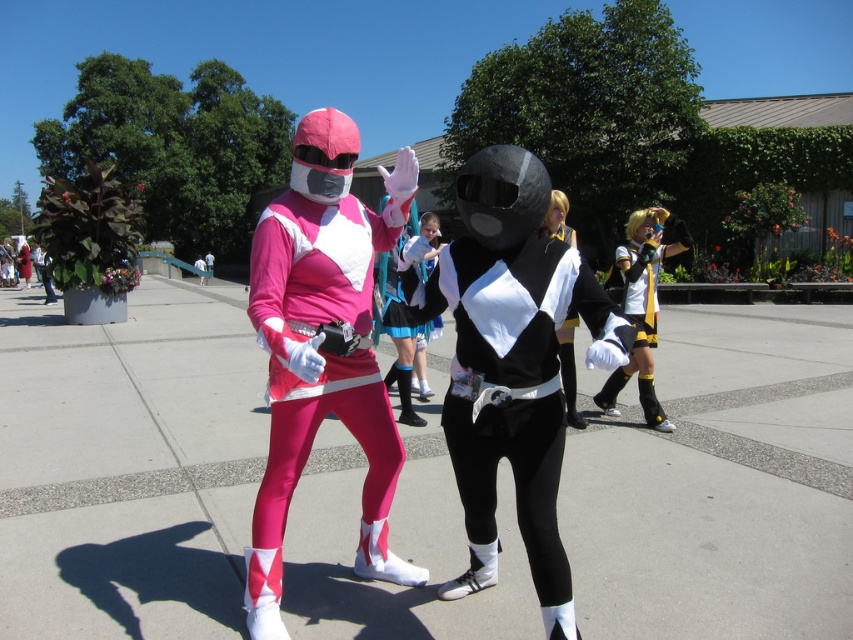
Who is shorter, matte pink costume at center or yellow and black fabric costume at right?

Standing shorter between the two is matte pink costume at center.

Who is positioned more to the left, matte pink costume at center or yellow and black fabric costume at right?

Positioned to the left is matte pink costume at center.

Which is behind, point (293, 381) or point (618, 372)?

The point (618, 372) is more distant.

Where is `matte pink costume at center`? Image resolution: width=853 pixels, height=640 pixels. matte pink costume at center is located at coordinates (323, 348).

Measure the distance between point (540, 428) and camera.

8.13 feet

Which is behind, point (527, 529) or point (583, 420)?

The point (583, 420) is more distant.

The width and height of the screenshot is (853, 640). Find the location of `black matte/soft material suit at center`. black matte/soft material suit at center is located at coordinates (515, 397).

From the picture: Is the position of matte pink costume at center less distant than that of black matte/soft material suit at center?

No.

Does matte pink costume at center appear over black matte/soft material suit at center?

Indeed, matte pink costume at center is positioned over black matte/soft material suit at center.

Locate an element on the screen. matte pink costume at center is located at coordinates [323, 348].

Identify the location of matte pink costume at center. The height and width of the screenshot is (640, 853). (323, 348).